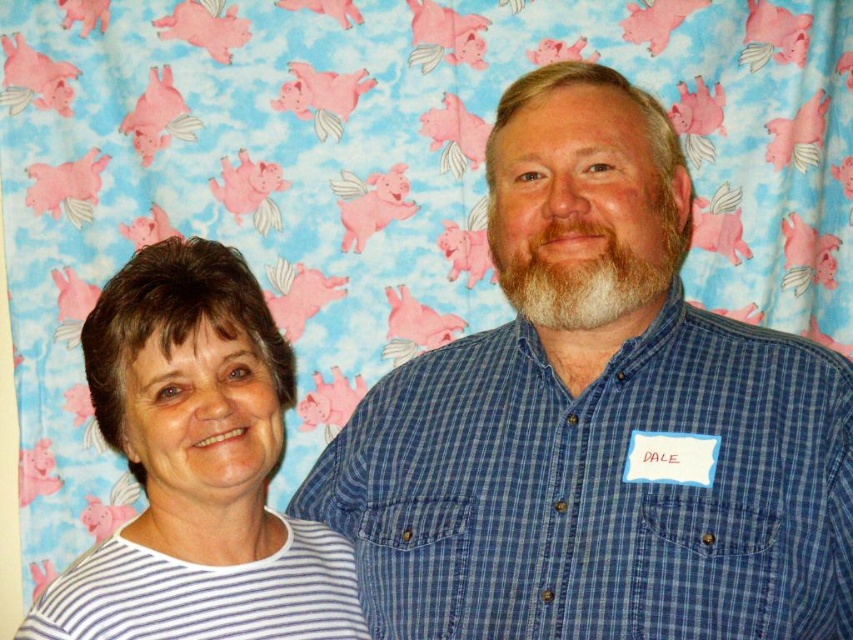
You are a photographer setting up for a group photo. You notice the blue checkered shirt at center and the white striped shirt at left. Which shirt is positioned higher in the image?

The blue checkered shirt at center is located above the white striped shirt at left, so it is positioned higher in the image.

You are a photographer trying to focus on two points in the image. One is point (428, 448) and the other is point (125, 348). Which point is closer to your camera?

Point (428, 448) is further to the camera than point (125, 348), so the closer point is point (125, 348).